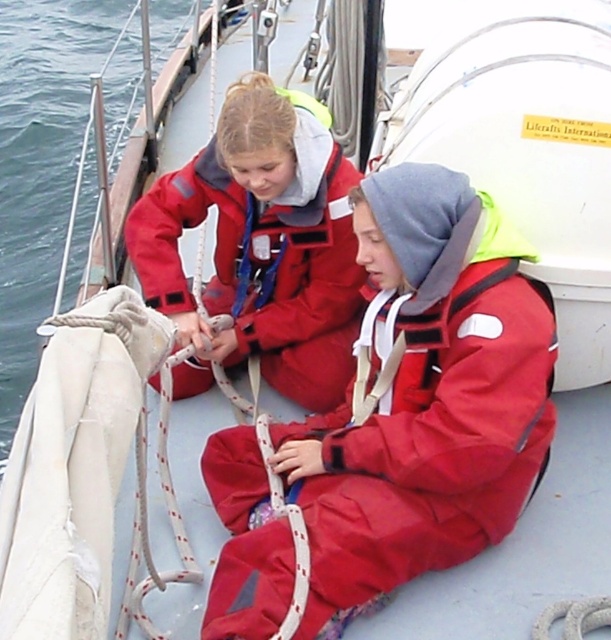
Question: Is red matte life jacket at center above matte red jacket at upper left?

Choices:
 (A) no
 (B) yes

Answer: (A)

Question: Can you confirm if red matte life jacket at center is positioned below matte red jacket at upper left?

Choices:
 (A) no
 (B) yes

Answer: (B)

Question: Which of the following is the closest to the observer?

Choices:
 (A) (491, 474)
 (B) (293, 248)

Answer: (A)

Question: Does red matte life jacket at center appear under matte red jacket at upper left?

Choices:
 (A) no
 (B) yes

Answer: (B)